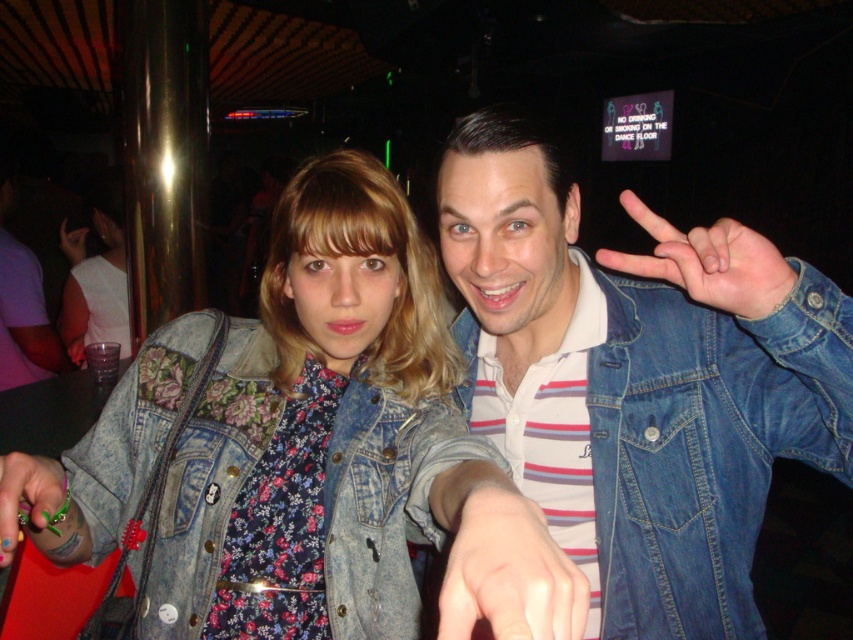
Question: Is denim at right below matte black hand at center?

Choices:
 (A) yes
 (B) no

Answer: (A)

Question: Which is nearer to the floral fabric dress at center?

Choices:
 (A) denim at right
 (B) matte black hand at center

Answer: (B)

Question: Does green plastic ring at lower left appear on the right side of matte black hand at center?

Choices:
 (A) no
 (B) yes

Answer: (B)

Question: Can you confirm if denim at right is positioned below floral fabric dress at center?

Choices:
 (A) yes
 (B) no

Answer: (A)

Question: Which point is closer to the camera?

Choices:
 (A) (61, 337)
 (B) (79, 246)

Answer: (A)

Question: Which point is farther to the camera?

Choices:
 (A) floral fabric dress at center
 (B) denim at right
 (C) green plastic ring at lower left

Answer: (A)